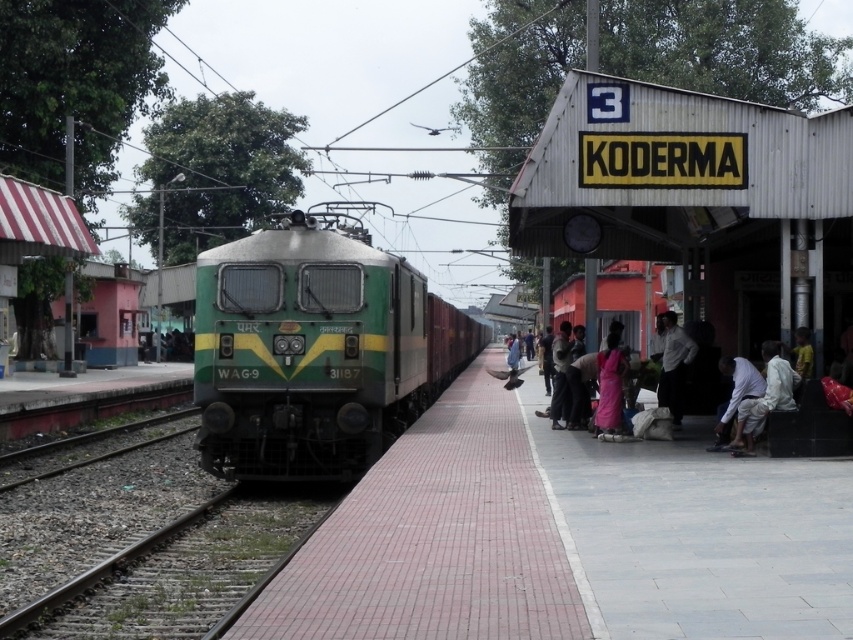
Question: Among these points, which one is farthest from the camera?

Choices:
 (A) [605, 477]
 (B) [809, 392]
 (C) [761, 410]

Answer: (C)

Question: From the image, what is the correct spatial relationship of pink tile platform at center in relation to white cotton clothing at lower right?

Choices:
 (A) below
 (B) above

Answer: (A)

Question: Among these points, which one is nearest to the camera?

Choices:
 (A) (329, 250)
 (B) (454, 538)
 (C) (675, 321)

Answer: (B)

Question: Is pink tile platform at center further to camera compared to white shirt at center?

Choices:
 (A) yes
 (B) no

Answer: (B)

Question: Among these points, which one is nearest to the camera?

Choices:
 (A) (688, 173)
 (B) (387, 317)
 (C) (189, 532)
 (D) (718, 410)

Answer: (C)

Question: Is pink tile platform at center to the right of gravelly brown train track at lower left from the viewer's perspective?

Choices:
 (A) yes
 (B) no

Answer: (A)